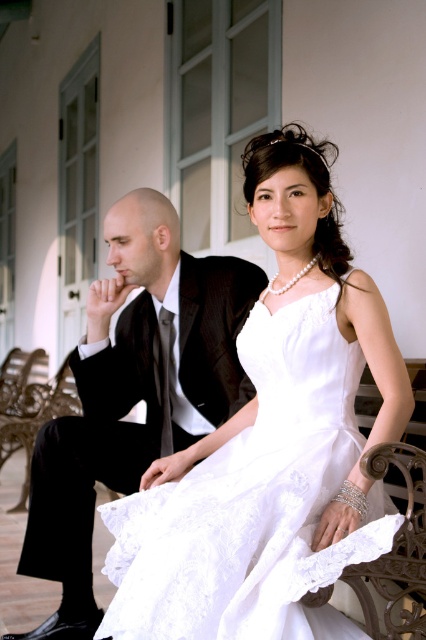
Consider the image. Can you confirm if white lace dress at center is taller than matte black suit at left?

Incorrect, white lace dress at center's height is not larger of matte black suit at left's.

Does white lace dress at center have a greater width compared to matte black suit at left?

No.

Is point (241, 337) closer to camera compared to point (91, 365)?

That is True.

You are a GUI agent. You are given a task and a screenshot of the screen. Output one action in this format:
    pyautogui.click(x=<x>, y=<y>)
    Task: Click on the white lace dress at center
    
    Given the screenshot: What is the action you would take?
    pyautogui.click(x=255, y=500)